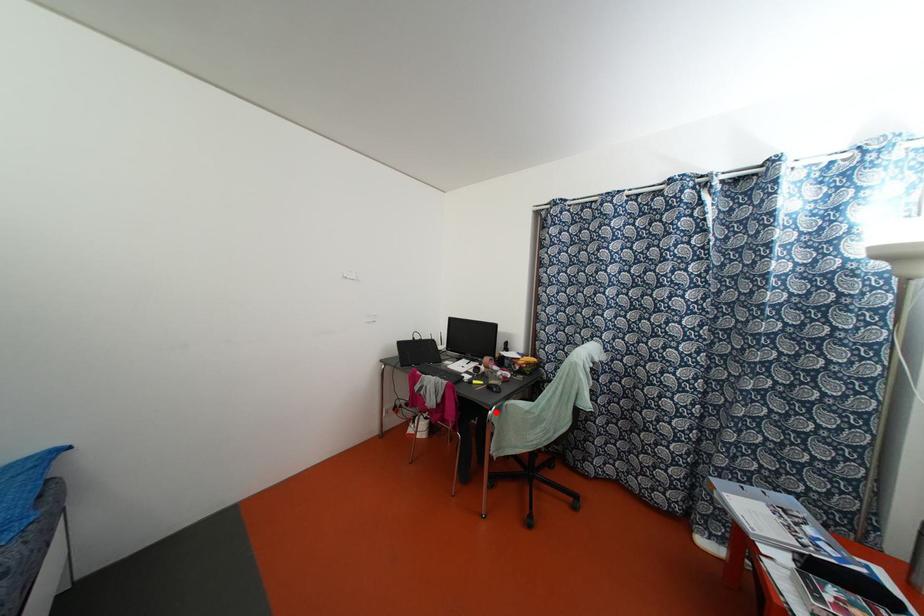
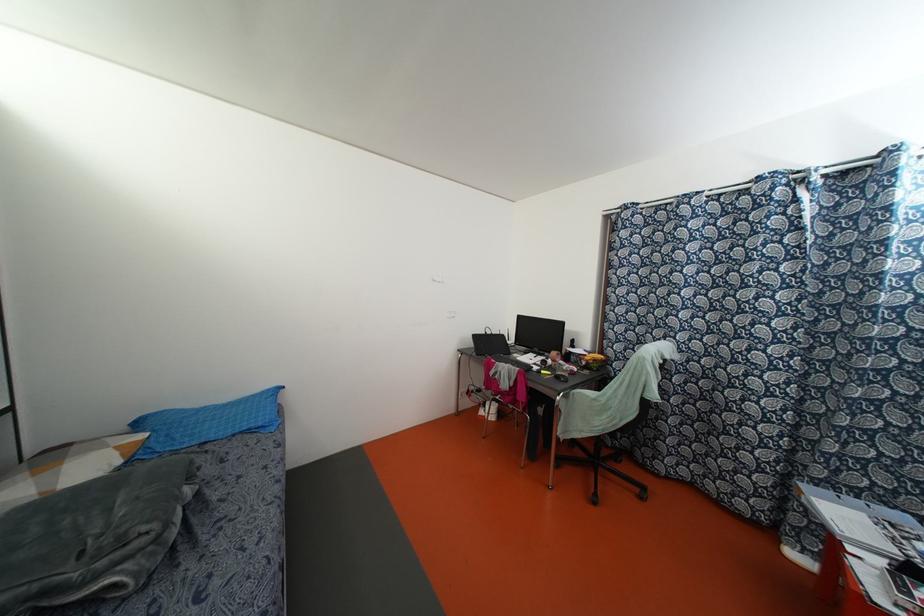
Where in the second image is the point corresponding to the highlighted location from the first image?

(564, 399)